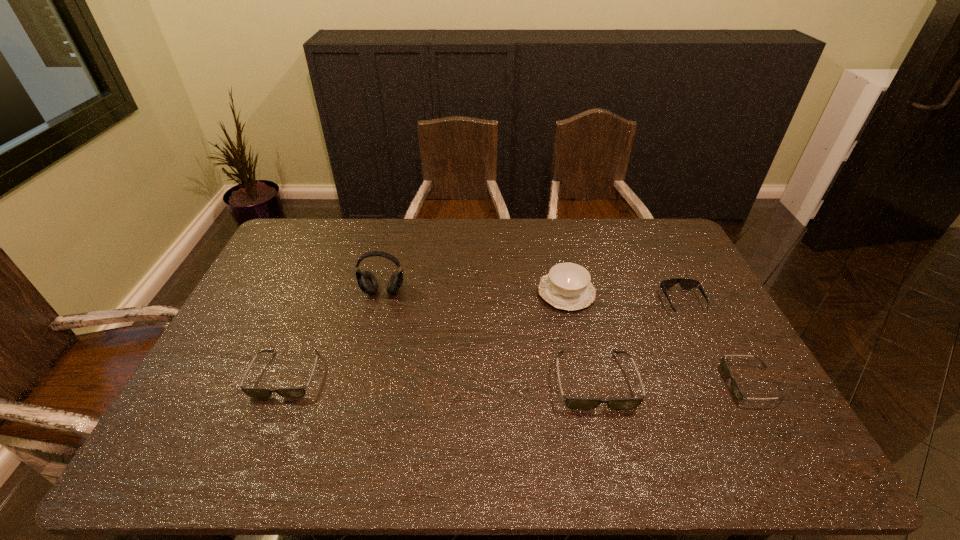
Find the location of `free point between the shortest sunglasses and the tallest object`. free point between the shortest sunglasses and the tallest object is located at coordinates (567, 338).

I want to click on free space between the fourth shortest object and the farthest sunglasses, so click(638, 341).

You are a GUI agent. You are given a task and a screenshot of the screen. Output one action in this format:
    pyautogui.click(x=<x>, y=<y>)
    Task: Click on the unoccupied position between the second tallest object and the farthest sunglasses
    This screenshot has width=960, height=540.
    Given the screenshot: What is the action you would take?
    pyautogui.click(x=624, y=298)

What are the coordinates of `object that is the closest to the shortest sunglasses` in the screenshot? It's located at (684, 283).

I want to click on object that stands as the fifth closest to the shortest object, so click(x=252, y=392).

Identify which sunglasses is the third nearest to the shortest object. Please provide its 2D coordinates. Your answer should be formatted as a tuple, i.e. [(x, y)], where the tuple contains the x and y coordinates of a point satisfying the conditions above.

[(252, 392)]

I want to click on sunglasses that is the closest to the second object from left to right, so click(x=252, y=392).